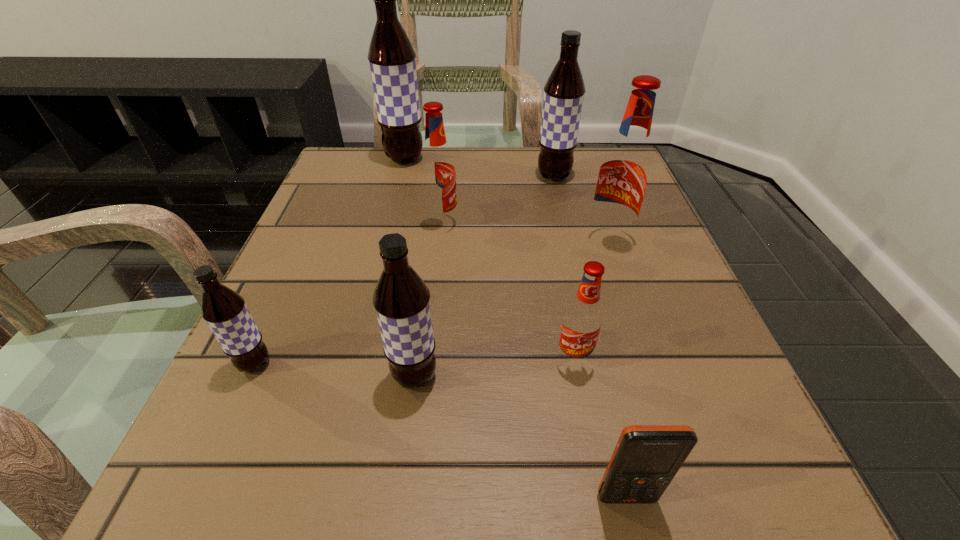
You are a GUI agent. You are given a task and a screenshot of the screen. Output one action in this format:
    pyautogui.click(x=<x>, y=<y>)
    Task: Click on the cellular telephone that is at the right edge
    The height and width of the screenshot is (540, 960).
    Given the screenshot: What is the action you would take?
    pyautogui.click(x=646, y=458)

This screenshot has height=540, width=960. In order to click on object located in the far left corner section of the desktop in this screenshot , I will do `click(391, 56)`.

You are a GUI agent. You are given a task and a screenshot of the screen. Output one action in this format:
    pyautogui.click(x=<x>, y=<y>)
    Task: Click on the object that is at the far right corner
    Image resolution: width=960 pixels, height=540 pixels.
    Given the screenshot: What is the action you would take?
    pyautogui.click(x=564, y=91)

This screenshot has height=540, width=960. Find the location of `object located at the near right corner`. object located at the near right corner is located at coordinates (646, 458).

Find the location of a particular element. Image resolution: width=960 pixels, height=540 pixels. vacant region at the far edge of the desktop is located at coordinates (530, 197).

Find the location of a particular element. free region at the near edge of the desktop is located at coordinates (582, 524).

The width and height of the screenshot is (960, 540). Find the location of `vacant space at the left edge`. vacant space at the left edge is located at coordinates [x=319, y=444].

Image resolution: width=960 pixels, height=540 pixels. In order to click on blank space at the right edge of the desktop in this screenshot , I will do `click(672, 272)`.

This screenshot has width=960, height=540. In order to click on vacant space at the far left corner of the desktop in this screenshot , I will do `click(377, 146)`.

In the image, there is a desktop. In order to click on free region at the far right corner in this screenshot , I will do `click(589, 187)`.